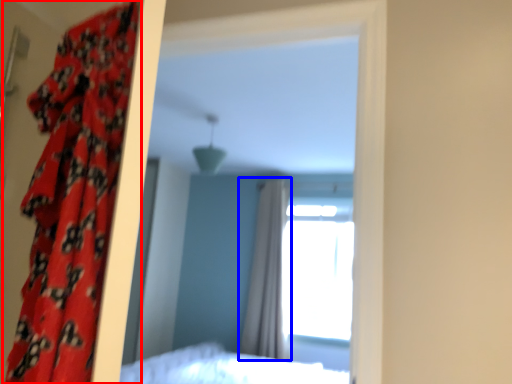
Question: Which point is further to the camera, curtain (highlighted by a red box) or curtain (highlighted by a blue box)?

Choices:
 (A) curtain
 (B) curtain

Answer: (B)